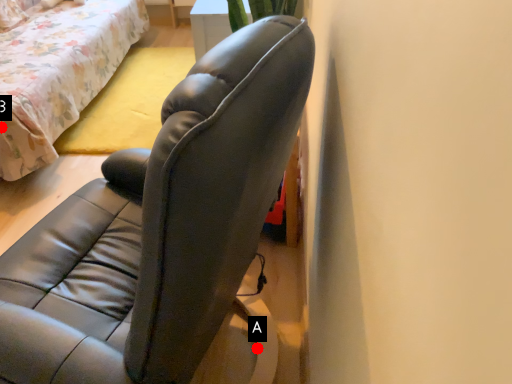
Question: Two points are circled on the image, labeled by A and B beside each circle. Which point is closer to the camera taking this photo?

Choices:
 (A) A is closer
 (B) B is closer

Answer: (A)